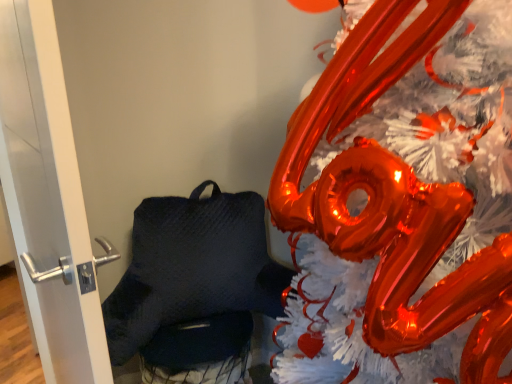
Question: In terms of width, does white glossy door handle at left look wider or thinner when compared to shiny metallic balloon at upper right?

Choices:
 (A) thin
 (B) wide

Answer: (A)

Question: Is white glossy door handle at left bigger or smaller than shiny metallic balloon at upper right?

Choices:
 (A) small
 (B) big

Answer: (A)

Question: Do you think white glossy door handle at left is within shiny metallic balloon at upper right, or outside of it?

Choices:
 (A) outside
 (B) inside

Answer: (A)

Question: From a real-world perspective, is shiny metallic balloon at upper right positioned above or below white glossy door handle at left?

Choices:
 (A) below
 (B) above

Answer: (A)

Question: From the image's perspective, is shiny metallic balloon at upper right located above or below white glossy door handle at left?

Choices:
 (A) below
 (B) above

Answer: (A)

Question: Considering the positions of shiny metallic balloon at upper right and white glossy door handle at left in the image, is shiny metallic balloon at upper right wider or thinner than white glossy door handle at left?

Choices:
 (A) wide
 (B) thin

Answer: (A)

Question: In the image, is shiny metallic balloon at upper right positioned in front of or behind white glossy door handle at left?

Choices:
 (A) behind
 (B) front

Answer: (B)